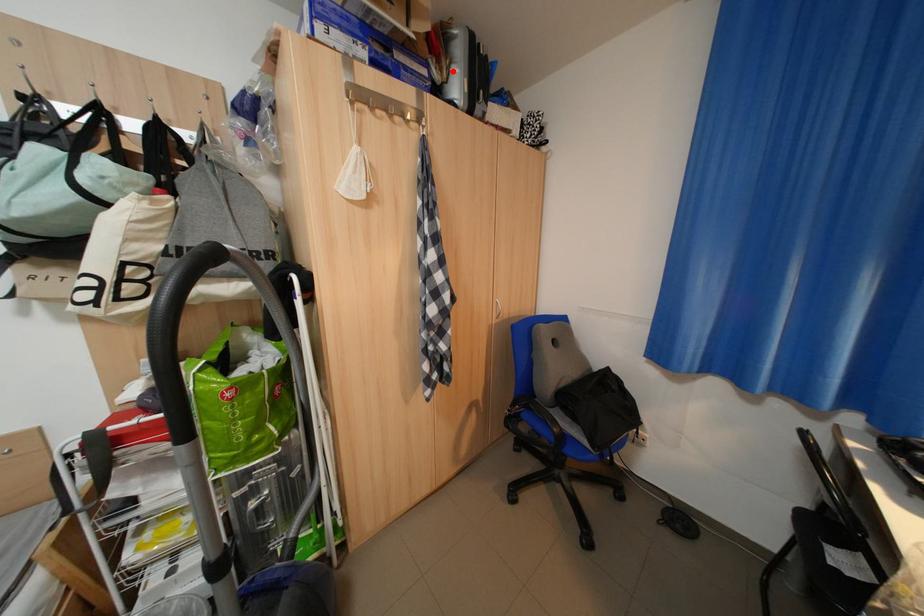
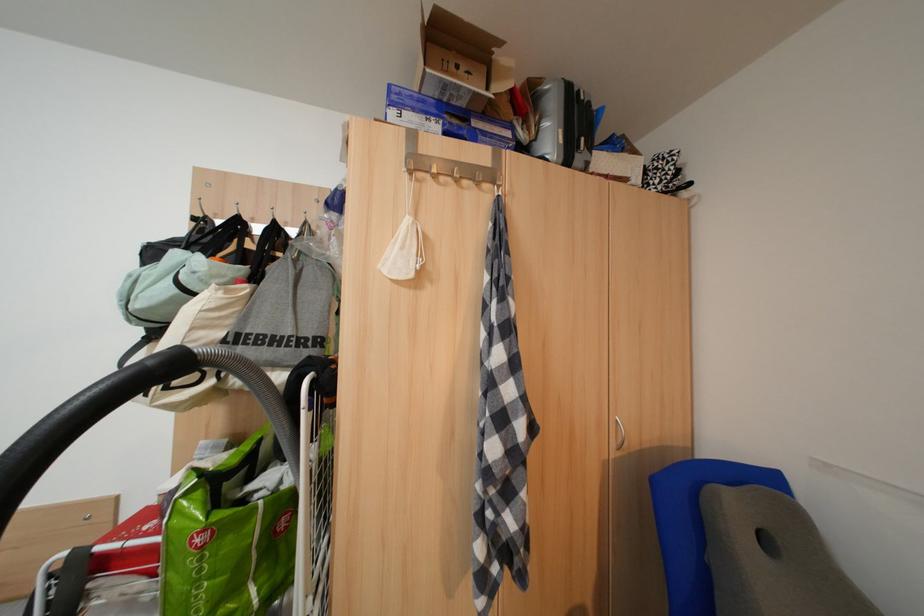
Question: I am providing you with two images of the same scene from different viewpoints. A red point is marked on the first image. Is the red point's position out of view in image 2?

Choices:
 (A) Yes
 (B) No

Answer: (B)